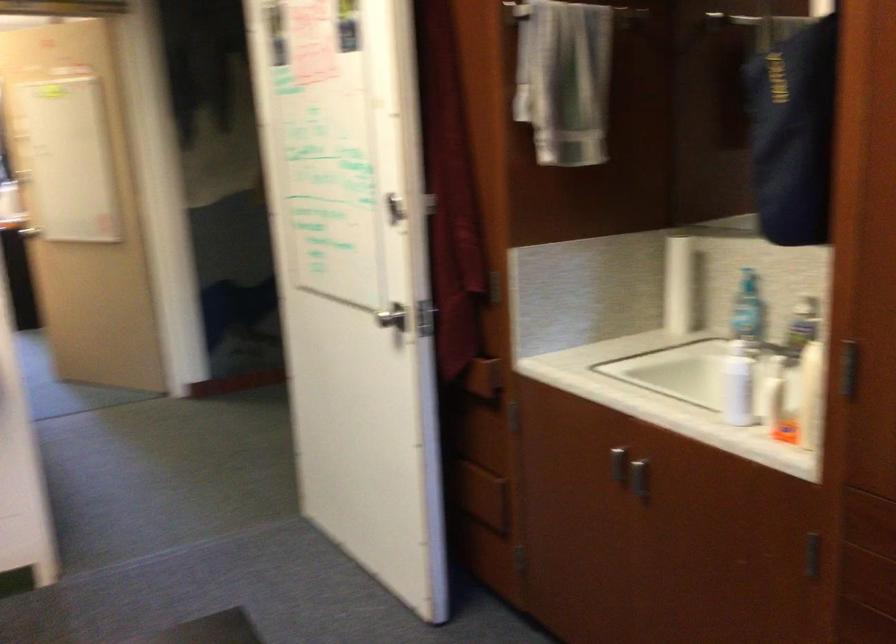
This screenshot has height=644, width=896. Describe the element at coordinates (391, 317) in the screenshot. I see `the silver door handle` at that location.